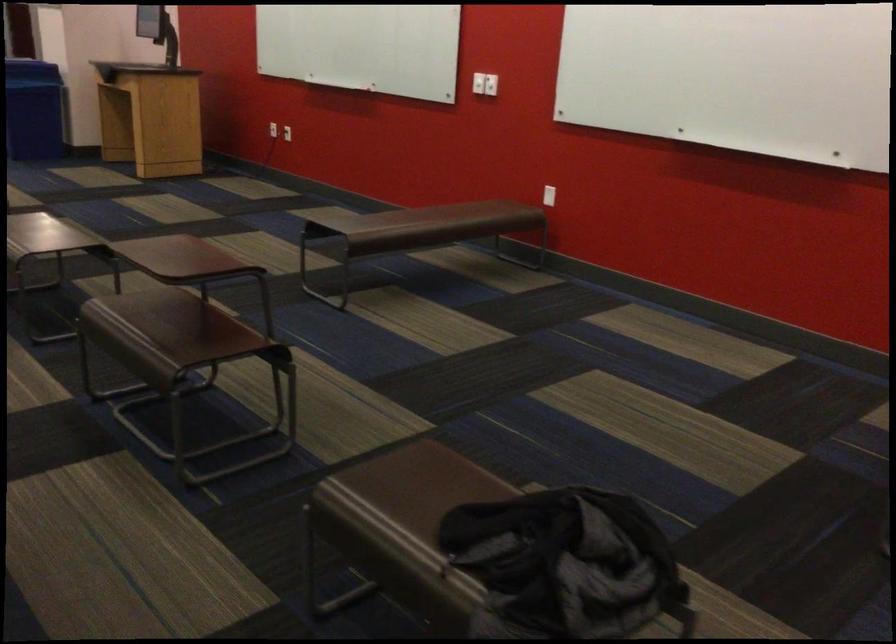
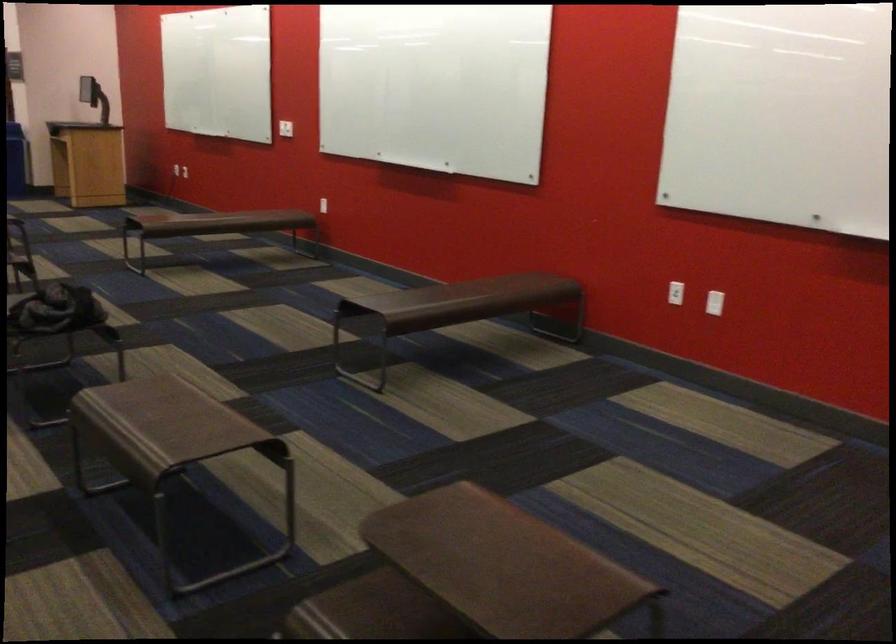
Where in the second image is the point corresponding to pixel 599 564 from the first image?

(56, 310)